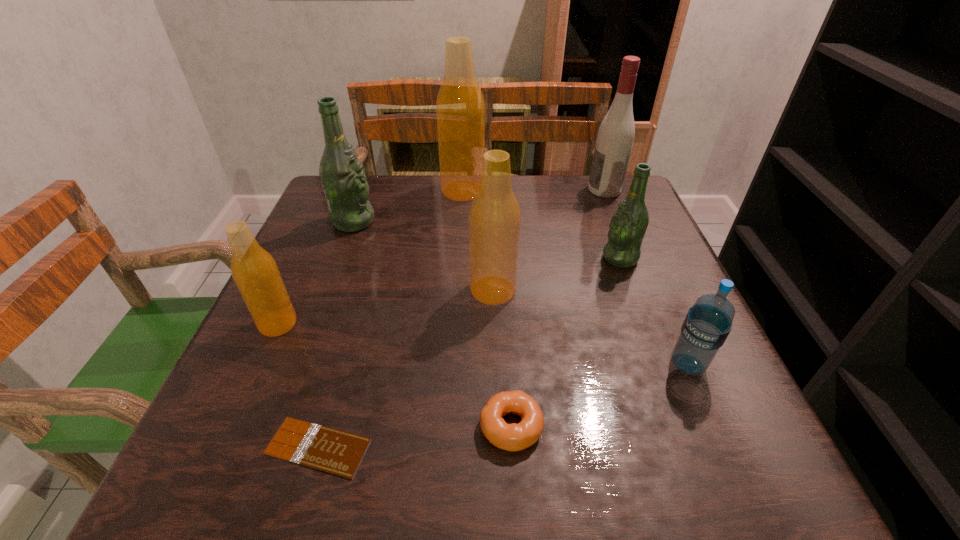
Where is `free spot located 0.280m on the surface of the bigger green beer bottle`? free spot located 0.280m on the surface of the bigger green beer bottle is located at coordinates (489, 221).

I want to click on vacant area situated 0.140m on the back of the second farthest tan beer bottle, so click(x=492, y=235).

This screenshot has height=540, width=960. I want to click on free point located 0.230m on the right of the leftmost tan beer bottle, so click(x=419, y=323).

Where is `vacant space located on the surface of the right green beer bottle`? Image resolution: width=960 pixels, height=540 pixels. vacant space located on the surface of the right green beer bottle is located at coordinates (580, 258).

You are a GUI agent. You are given a task and a screenshot of the screen. Output one action in this format:
    pyautogui.click(x=<x>, y=<y>)
    Task: Click on the vacant space situated on the surface of the right green beer bottle
    The width and height of the screenshot is (960, 540).
    Given the screenshot: What is the action you would take?
    pyautogui.click(x=548, y=258)

Find the location of a particular element. This screenshot has height=540, width=960. vacant space situated 0.280m on the surface of the right green beer bottle is located at coordinates (477, 258).

Where is `blank space located on the back of the blue water bottle`? The height and width of the screenshot is (540, 960). blank space located on the back of the blue water bottle is located at coordinates (630, 228).

The image size is (960, 540). Identify the location of vacant space located 0.400m on the left of the doughnut. (221, 426).

Locate an element on the screen. The height and width of the screenshot is (540, 960). vacant region located 0.400m on the back of the shortest object is located at coordinates (372, 256).

The height and width of the screenshot is (540, 960). In order to click on alcohol that is positioned at the far edge in this screenshot , I will do `click(615, 137)`.